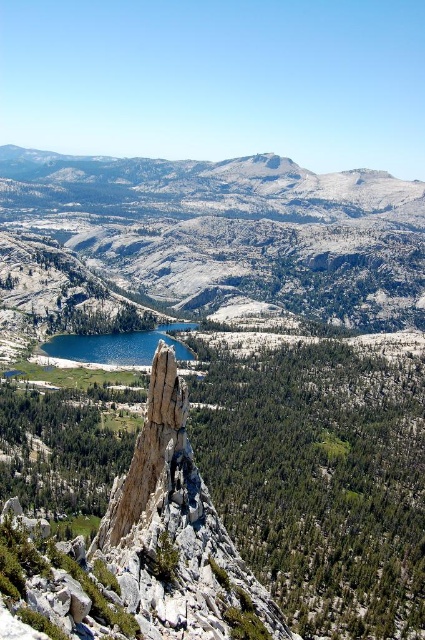
Who is more distant from viewer, [39,161] or [87,342]?

The point [39,161] is more distant.

Can you confirm if snowy granite mountain at center is shorter than blue glassy lake at center?

No.

Is point (302, 204) behind point (169, 337)?

Yes.

This screenshot has height=640, width=425. What are the coordinates of `snowy granite mountain at center` in the screenshot? It's located at (232, 230).

Which is above, snowy granite mountain at center or smooth gray rock formation at center?

snowy granite mountain at center is above.

Which is more to the right, snowy granite mountain at center or smooth gray rock formation at center?

smooth gray rock formation at center is more to the right.

Which is in front, point (166, 161) or point (172, 403)?

Point (172, 403) is more forward.

Identify the location of snowy granite mountain at center. tap(232, 230).

Can you confirm if smooth gray rock formation at center is wider than blue glassy lake at center?

No, smooth gray rock formation at center is not wider than blue glassy lake at center.

From the picture: Who is shorter, smooth gray rock formation at center or blue glassy lake at center?

blue glassy lake at center

Is point (274, 605) less distant than point (122, 349)?

That is True.

I want to click on smooth gray rock formation at center, so click(x=175, y=531).